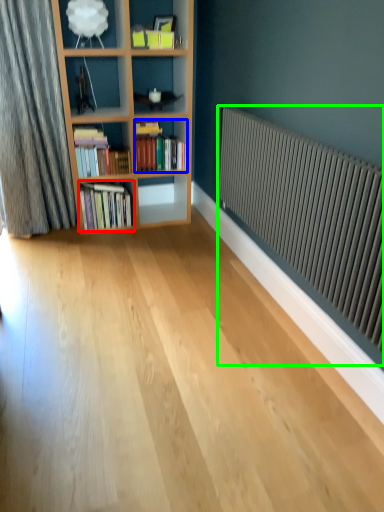
Question: Which object is positioned closest to book (highlighted by a red box)? Select from book (highlighted by a blue box) and radiator (highlighted by a green box).

Choices:
 (A) book
 (B) radiator

Answer: (A)